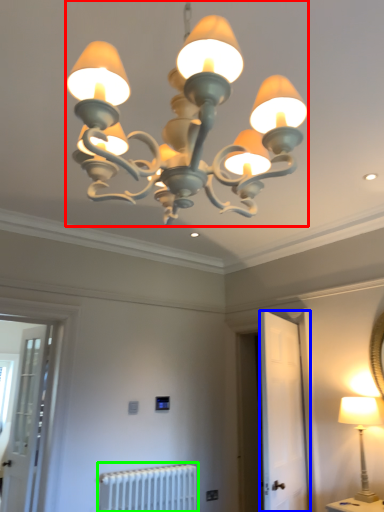
Question: Considering the real-world distances, which object is closest to lamp (highlighted by a red box)? screen door (highlighted by a blue box) or radiator (highlighted by a green box).

Choices:
 (A) screen door
 (B) radiator

Answer: (A)